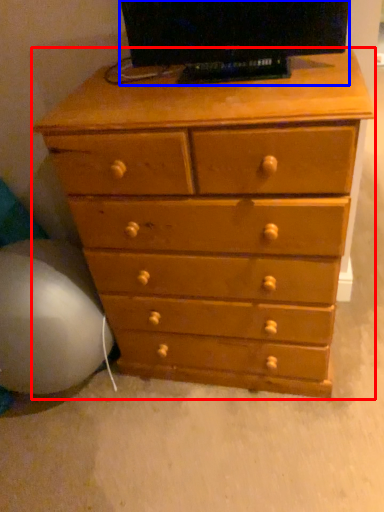
Question: Which object appears closest to the camera in this image, chest of drawers (highlighted by a red box) or television (highlighted by a blue box)?

Choices:
 (A) chest of drawers
 (B) television

Answer: (A)